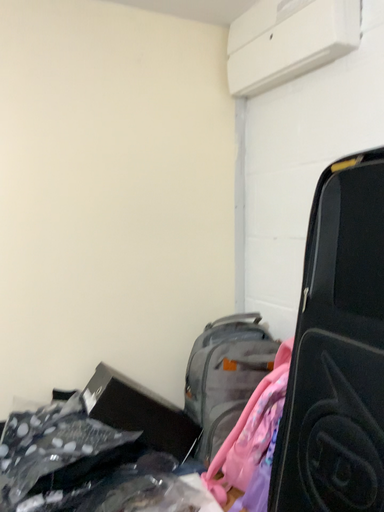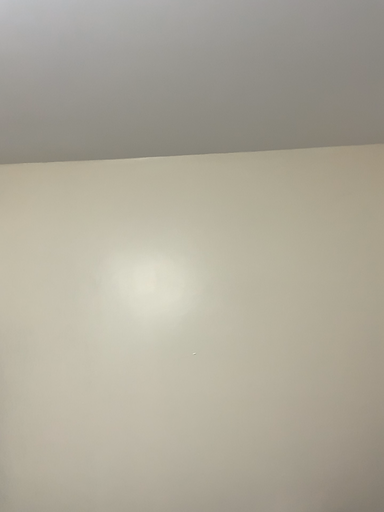
Question: How did the camera likely rotate when shooting the video?

Choices:
 (A) rotated left
 (B) rotated right

Answer: (A)